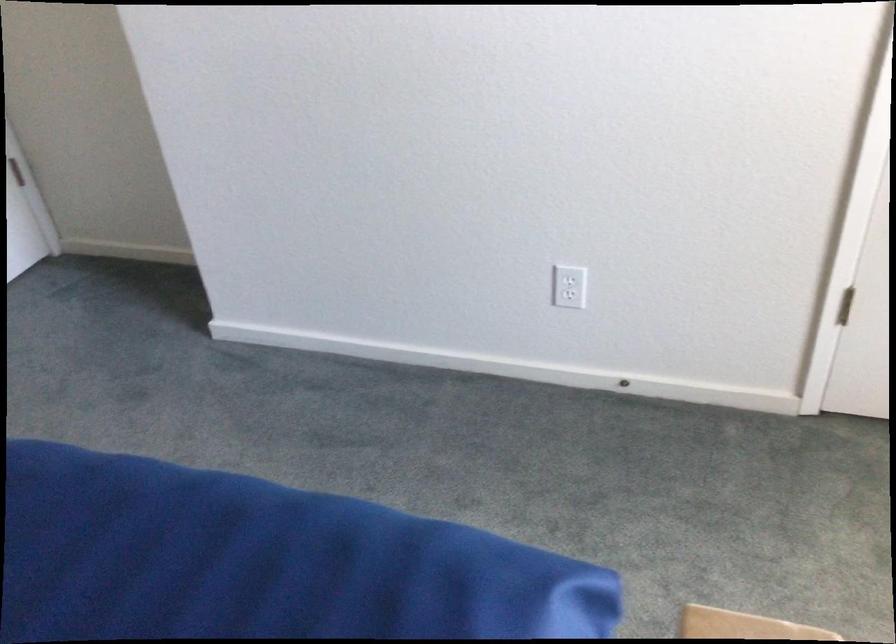
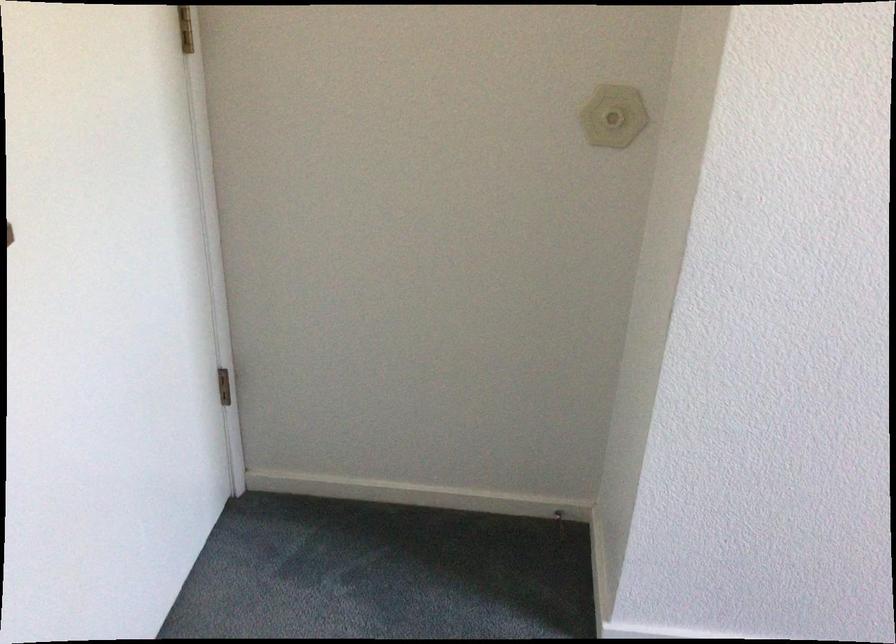
Which direction would the cameraman need to move to produce the second image?

The cameraman walked toward left, forward.